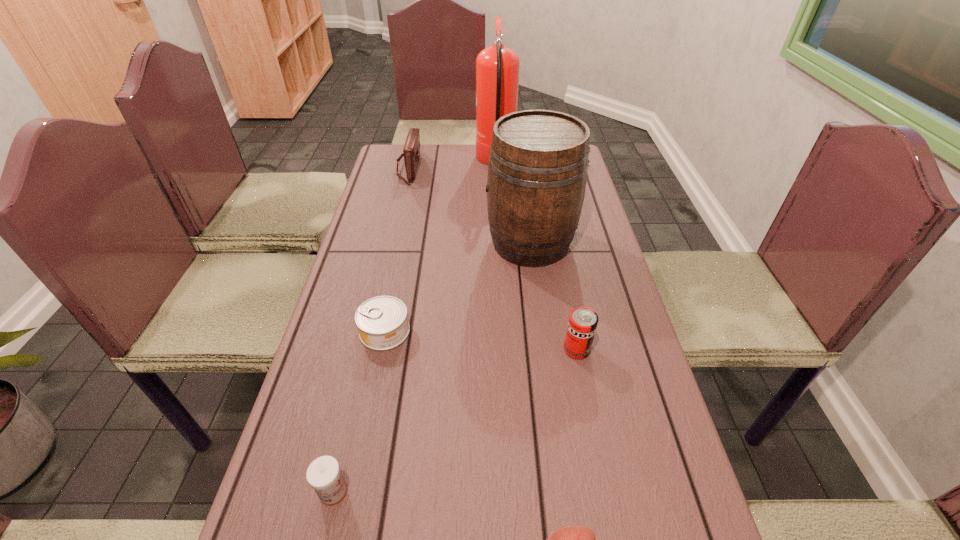
What are the coordinates of `free space located 0.230m towards the nozzle of the fire extinguisher` in the screenshot? It's located at (414, 162).

Identify the location of vacant space located towards the nozzle of the fire extinguisher. This screenshot has height=540, width=960. (406, 162).

Where is `free space located 0.250m on the side of the cider near the bung hole`? free space located 0.250m on the side of the cider near the bung hole is located at coordinates (400, 243).

Identify the location of free space located on the side of the cider near the bung hole. (444, 243).

Locate an element on the screen. vacant position located on the side of the cider near the bung hole is located at coordinates (462, 243).

This screenshot has height=540, width=960. In order to click on free space located on the front flap of the shoulder bag in this screenshot , I will do `click(506, 168)`.

Where is `free space located on the back of the right can`? This screenshot has width=960, height=540. free space located on the back of the right can is located at coordinates tap(568, 308).

Image resolution: width=960 pixels, height=540 pixels. Find the location of `free space located 0.220m on the back of the second shortest object`. free space located 0.220m on the back of the second shortest object is located at coordinates (361, 375).

Find the location of a particular element. This screenshot has width=960, height=540. vacant region located 0.190m on the back of the shortest object is located at coordinates (398, 262).

At what (x,y) coordinates should I click in order to perform the action: click on fire extinguisher located at the far edge. Please return your answer as a coordinate pair (x, y). This screenshot has width=960, height=540. Looking at the image, I should click on (497, 67).